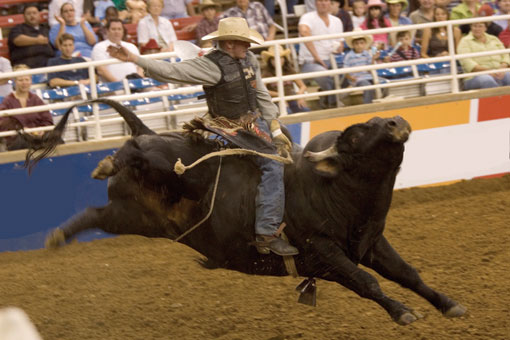
Identify the location of vertical railing. (93, 77), (278, 66), (452, 43).